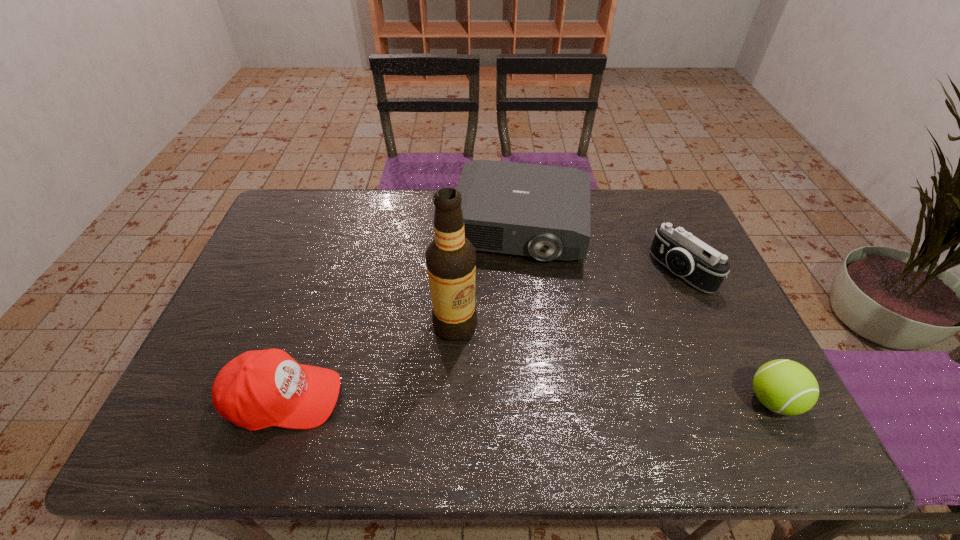
The width and height of the screenshot is (960, 540). In order to click on vacant space that satisfies the following two spatial constraints: 1. on the back side of the tallest object; 2. on the left side of the camera in this screenshot , I will do `click(458, 272)`.